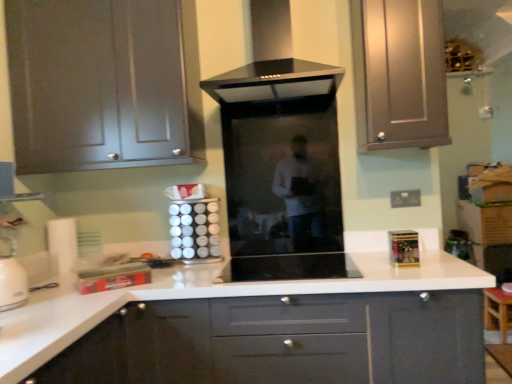
Describe the element at coordinates (282, 178) in the screenshot. I see `transparent glass door at center` at that location.

Looking at this image, in order to face transparent glass door at center, should I rotate leftwards or rightwards?

A 3.667 degree turn to the right will do.

What do you see at coordinates (273, 64) in the screenshot?
I see `black glass range hood at center` at bounding box center [273, 64].

Where is `black glass range hood at center`? The height and width of the screenshot is (384, 512). black glass range hood at center is located at coordinates (273, 64).

How much space does glossy white cabinet at center, which is the 1th cabinetry in bottom-to-top order, occupy horizontally?

glossy white cabinet at center, which is the 1th cabinetry in bottom-to-top order, is 25.15 inches wide.

Describe the element at coordinates (399, 74) in the screenshot. I see `satin silver cabinet at upper right, positioned as the second cabinetry in top-to-bottom order` at that location.

This screenshot has height=384, width=512. I want to click on white glossy canisters at center, the 3th appliance positioned from the right, so click(195, 230).

Is gold metallic spice rack at right, marked as the 4th appliance in a left-to-right arrangement, in contact with satin silver cabinet at upper right, positioned as the second cabinetry in top-to-bottom order?

No, gold metallic spice rack at right, marked as the 4th appliance in a left-to-right arrangement, is not in contact with satin silver cabinet at upper right, positioned as the second cabinetry in top-to-bottom order.

Is gold metallic spice rack at right, marked as the 4th appliance in a left-to-right arrangement, spatially inside satin silver cabinet at upper right, positioned as the second cabinetry in top-to-bottom order, or outside of it?

gold metallic spice rack at right, marked as the 4th appliance in a left-to-right arrangement, lies outside satin silver cabinet at upper right, positioned as the second cabinetry in top-to-bottom order.

From the image's perspective, is gold metallic spice rack at right, the first appliance when ordered from right to left, above or below satin silver cabinet at upper right, positioned as the second cabinetry in top-to-bottom order?

From the image's perspective, gold metallic spice rack at right, the first appliance when ordered from right to left, appears below satin silver cabinet at upper right, positioned as the second cabinetry in top-to-bottom order.

Which point is more distant from viewer, [412,263] or [383,39]?

Point [383,39]

Looking at this image, who is smaller, white glossy canisters at center, the 2th appliance from the left, or satin silver cabinet at upper right, acting as the second cabinetry starting from the bottom?

With smaller size is white glossy canisters at center, the 2th appliance from the left.

Which object is closer to the camera taking this photo, white glossy canisters at center, the 3th appliance positioned from the right, or satin silver cabinet at upper right, acting as the second cabinetry starting from the bottom?

satin silver cabinet at upper right, acting as the second cabinetry starting from the bottom, is closer to the camera.

Is white glossy canisters at center, the 2th appliance from the left, not close to satin silver cabinet at upper right, acting as the second cabinetry starting from the bottom?

Yes.

Could you measure the distance between white glossy canisters at center, the 2th appliance from the left, and satin silver cabinet at upper right, acting as the second cabinetry starting from the bottom?

The distance of white glossy canisters at center, the 2th appliance from the left, from satin silver cabinet at upper right, acting as the second cabinetry starting from the bottom, is 3.38 feet.

Would you say glossy white cabinet at center, which is counted as the 3th cabinetry, starting from the top, is inside or outside white glossy canisters at center, the 2th appliance from the left?

glossy white cabinet at center, which is counted as the 3th cabinetry, starting from the top, exists outside the volume of white glossy canisters at center, the 2th appliance from the left.

In the scene shown: Is glossy white cabinet at center, which is the 1th cabinetry in bottom-to-top order, next to white glossy canisters at center, the 3th appliance positioned from the right?

There is a gap between glossy white cabinet at center, which is the 1th cabinetry in bottom-to-top order, and white glossy canisters at center, the 3th appliance positioned from the right.

Based on the photo, which object is thinner, glossy white cabinet at center, which is counted as the 3th cabinetry, starting from the top, or white glossy canisters at center, the 2th appliance from the left?

Thinner between the two is white glossy canisters at center, the 2th appliance from the left.

From a real-world perspective, is glossy white cabinet at center, which is the 1th cabinetry in bottom-to-top order, above or below white glossy canisters at center, the 2th appliance from the left?

glossy white cabinet at center, which is the 1th cabinetry in bottom-to-top order, is situated lower than white glossy canisters at center, the 2th appliance from the left, in the real world.

Choose the correct answer: Is glossy white cabinet at center, which is counted as the 3th cabinetry, starting from the top, inside black glass cooktop at center, placed as the 2th appliance when sorted from right to left, or outside it?

glossy white cabinet at center, which is counted as the 3th cabinetry, starting from the top, exists outside the volume of black glass cooktop at center, placed as the 2th appliance when sorted from right to left.

Find the location of a particular element. This screenshot has width=512, height=384. cabinetry below the black glass cooktop at center, placed as the 2th appliance when sorted from right to left (from a real-world perspective) is located at coordinates (283, 341).

Consider the image. Considering the relative sizes of glossy white cabinet at center, which is the 1th cabinetry in bottom-to-top order, and black glass cooktop at center, the 3th appliance positioned from the left, in the image provided, is glossy white cabinet at center, which is the 1th cabinetry in bottom-to-top order, smaller than black glass cooktop at center, the 3th appliance positioned from the left,?

No.

Could you measure the distance between glossy white cabinet at center, which is counted as the 3th cabinetry, starting from the top, and black glass cooktop at center, placed as the 2th appliance when sorted from right to left?

A distance of 10.36 inches exists between glossy white cabinet at center, which is counted as the 3th cabinetry, starting from the top, and black glass cooktop at center, placed as the 2th appliance when sorted from right to left.

Is black glass range hood at center to the left of black glass cooktop at center, placed as the 2th appliance when sorted from right to left, from the viewer's perspective?

Indeed, black glass range hood at center is positioned on the left side of black glass cooktop at center, placed as the 2th appliance when sorted from right to left.

From the picture: How many degrees apart are the facing directions of black glass range hood at center and black glass cooktop at center, the 3th appliance positioned from the left?

There is a 0.913-degree angle between the facing directions of black glass range hood at center and black glass cooktop at center, the 3th appliance positioned from the left.

Is black glass range hood at center next to black glass cooktop at center, placed as the 2th appliance when sorted from right to left?

There is a gap between black glass range hood at center and black glass cooktop at center, placed as the 2th appliance when sorted from right to left.

Is black glass cooktop at center, placed as the 2th appliance when sorted from right to left, located within black glass range hood at center?

No.

Is metallic silver toaster at lower left, the first appliance when ordered from left to right, further to the viewer compared to glossy white cabinet at center, which is the 1th cabinetry in bottom-to-top order?

Yes, the depth of metallic silver toaster at lower left, the first appliance when ordered from left to right, is greater than that of glossy white cabinet at center, which is the 1th cabinetry in bottom-to-top order.

Which is more to the right, metallic silver toaster at lower left, which is the 4th appliance in right-to-left order, or glossy white cabinet at center, which is the 1th cabinetry in bottom-to-top order?

Positioned to the right is glossy white cabinet at center, which is the 1th cabinetry in bottom-to-top order.

Does metallic silver toaster at lower left, which is the 4th appliance in right-to-left order, have a lesser height compared to glossy white cabinet at center, which is counted as the 3th cabinetry, starting from the top?

Indeed, metallic silver toaster at lower left, which is the 4th appliance in right-to-left order, has a lesser height compared to glossy white cabinet at center, which is counted as the 3th cabinetry, starting from the top.

How many degrees apart are the facing directions of metallic silver toaster at lower left, the first appliance when ordered from left to right, and glossy white cabinet at center, which is the 1th cabinetry in bottom-to-top order?

There is a 33.9-degree angle between the facing directions of metallic silver toaster at lower left, the first appliance when ordered from left to right, and glossy white cabinet at center, which is the 1th cabinetry in bottom-to-top order.

Does point (92, 271) come in front of point (281, 28)?

Yes, point (92, 271) is in front of point (281, 28).

Based on their sizes in the image, would you say metallic silver toaster at lower left, the first appliance when ordered from left to right, is bigger or smaller than black glass range hood at center?

In the image, metallic silver toaster at lower left, the first appliance when ordered from left to right, appears to be smaller than black glass range hood at center.

What's the angular difference between metallic silver toaster at lower left, the first appliance when ordered from left to right, and black glass range hood at center's facing directions?

The angular difference between metallic silver toaster at lower left, the first appliance when ordered from left to right, and black glass range hood at center is 34.1 degrees.

Between metallic silver toaster at lower left, the first appliance when ordered from left to right, and black glass range hood at center, which one has more height?

black glass range hood at center.

Where is `the 1st cabinetry above when counting from the gold metallic spice rack at right, the first appliance when ordered from right to left (from the image's perspective)`? the 1st cabinetry above when counting from the gold metallic spice rack at right, the first appliance when ordered from right to left (from the image's perspective) is located at coordinates (399, 74).

I want to click on the 2nd cabinetry to the right when counting from the white glossy canisters at center, the 2th appliance from the left, so [399, 74].

Considering their positions, is transparent glass door at center positioned further to white glossy canisters at center, the 3th appliance positioned from the right, than black glass cooktop at center, the 3th appliance positioned from the left?

Based on the image, black glass cooktop at center, the 3th appliance positioned from the left, appears to be further to white glossy canisters at center, the 3th appliance positioned from the right.

Considering their positions, is white glossy canisters at center, the 3th appliance positioned from the right, positioned further to gold metallic spice rack at right, the first appliance when ordered from right to left, than glossy white cabinet at center, which is the 1th cabinetry in bottom-to-top order?

white glossy canisters at center, the 3th appliance positioned from the right, lies further to gold metallic spice rack at right, the first appliance when ordered from right to left, than the other object.

Which object lies nearer to the anchor point black glass cooktop at center, placed as the 2th appliance when sorted from right to left, black glass range hood at center or satin silver cabinet at upper right, positioned as the second cabinetry in top-to-bottom order?

satin silver cabinet at upper right, positioned as the second cabinetry in top-to-bottom order.

From the image, which object appears to be nearer to gold metallic spice rack at right, the first appliance when ordered from right to left, black glass cooktop at center, placed as the 2th appliance when sorted from right to left, or glossy white cabinet at center, which is the 1th cabinetry in bottom-to-top order?

black glass cooktop at center, placed as the 2th appliance when sorted from right to left, is positioned closer to the anchor gold metallic spice rack at right, the first appliance when ordered from right to left.

From the image, which object appears to be farther from metallic silver toaster at lower left, the first appliance when ordered from left to right, glossy white cabinet at center, which is counted as the 3th cabinetry, starting from the top, or matte gray cabinet at upper left, acting as the 3th cabinetry starting from the bottom?

Based on the image, matte gray cabinet at upper left, acting as the 3th cabinetry starting from the bottom, appears to be further to metallic silver toaster at lower left, the first appliance when ordered from left to right.

Which object lies nearer to the anchor point satin silver cabinet at upper right, positioned as the second cabinetry in top-to-bottom order, metallic silver toaster at lower left, the first appliance when ordered from left to right, or gold metallic spice rack at right, the first appliance when ordered from right to left?

gold metallic spice rack at right, the first appliance when ordered from right to left, is positioned closer to the anchor satin silver cabinet at upper right, positioned as the second cabinetry in top-to-bottom order.

Looking at the image, which one is located closer to gold metallic spice rack at right, the first appliance when ordered from right to left, satin silver cabinet at upper right, acting as the second cabinetry starting from the bottom, or white glossy canisters at center, the 2th appliance from the left?

satin silver cabinet at upper right, acting as the second cabinetry starting from the bottom.

Considering their positions, is black glass range hood at center positioned further to gold metallic spice rack at right, marked as the 4th appliance in a left-to-right arrangement, than glossy white cabinet at center, which is the 1th cabinetry in bottom-to-top order?

black glass range hood at center lies further to gold metallic spice rack at right, marked as the 4th appliance in a left-to-right arrangement, than the other object.

Identify the location of glass door between satin silver cabinet at upper right, acting as the second cabinetry starting from the bottom, and glossy white cabinet at center, which is the 1th cabinetry in bottom-to-top order, in the vertical direction. (282, 178).

This screenshot has height=384, width=512. In order to click on cabinetry located between white glossy canisters at center, the 3th appliance positioned from the right, and gold metallic spice rack at right, marked as the 4th appliance in a left-to-right arrangement, in the left-right direction in this screenshot , I will do `click(283, 341)`.

Identify the location of home appliance between metallic silver toaster at lower left, the first appliance when ordered from left to right, and gold metallic spice rack at right, the first appliance when ordered from right to left, in the horizontal direction. (273, 64).

Identify the location of glass door between black glass range hood at center and white glossy canisters at center, the 2th appliance from the left, from top to bottom. (282, 178).